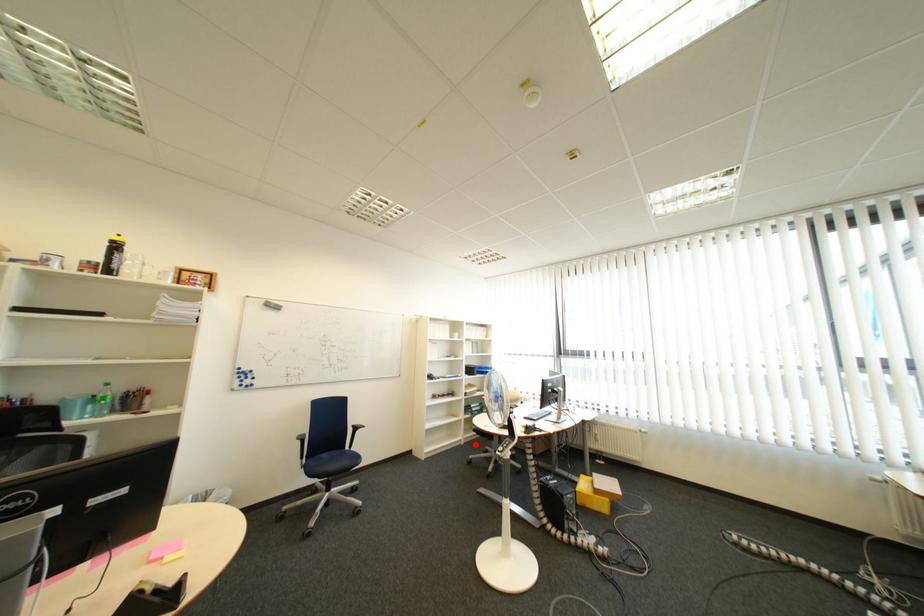
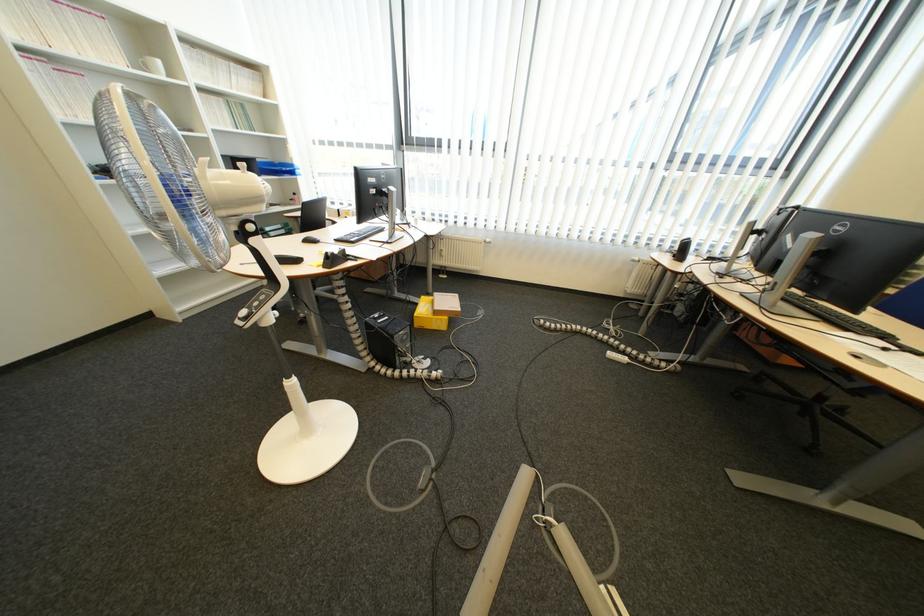
Question: I am providing you with two images of the same scene from different viewpoints. Given a red point in image1, look at the same physical point in image2. Is it:

Choices:
 (A) Closer to the viewpoint
 (B) Farther from the viewpoint

Answer: (A)